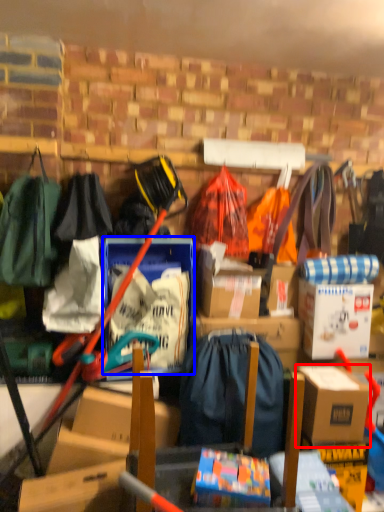
Question: Which point is further to the camera, box (highlighted by a red box) or storage box (highlighted by a blue box)?

Choices:
 (A) box
 (B) storage box

Answer: (B)